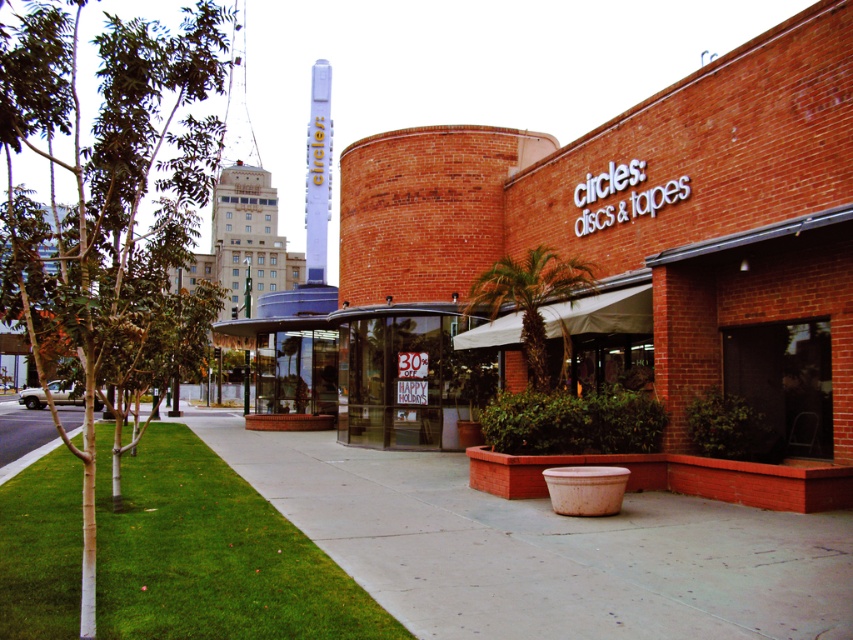
Is concrete at center wider than green leafy palm at center?

Yes, concrete at center is wider than green leafy palm at center.

Between point (328, 545) and point (532, 317), which one is positioned behind?

Point (532, 317)

At what (x,y) coordinates should I click in order to perform the action: click on concrete at center. Please return your answer as a coordinate pair (x, y). The image size is (853, 640). Looking at the image, I should click on (543, 547).

How distant is concrete at center from green grass at lower left?

2.04 meters

What do you see at coordinates (543, 547) in the screenshot? I see `concrete at center` at bounding box center [543, 547].

The image size is (853, 640). Find the location of `concrete at center`. concrete at center is located at coordinates (543, 547).

Looking at this image, does concrete at center have a smaller size compared to green leafy tree at left?

Yes.

Which is in front, point (503, 600) or point (177, 156)?

Positioned in front is point (503, 600).

Where is `concrete at center`? The image size is (853, 640). concrete at center is located at coordinates (543, 547).